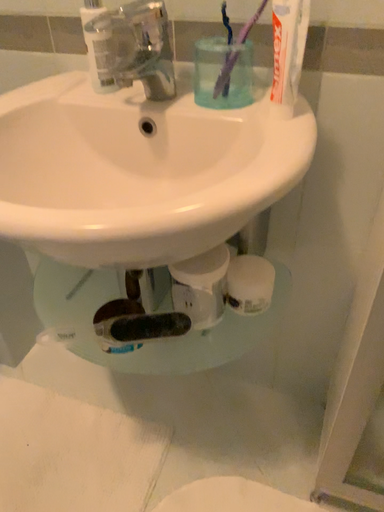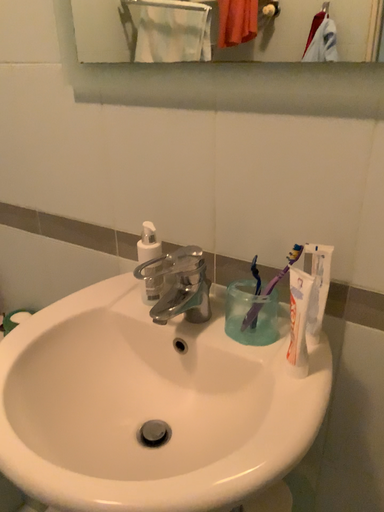
Question: How did the camera likely rotate when shooting the video?

Choices:
 (A) rotated downward
 (B) rotated upward

Answer: (B)